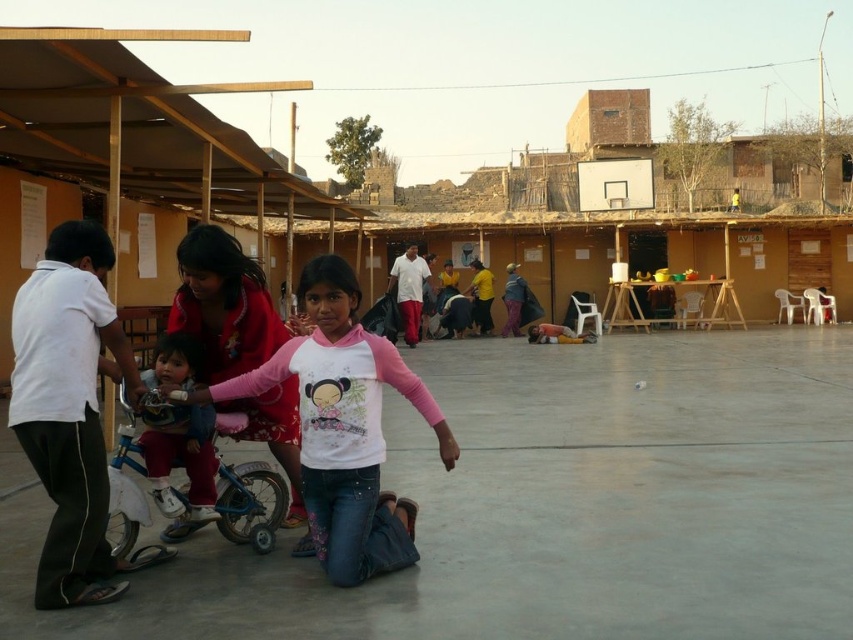
Question: Which object is the closest to the pink fabric shirt at center?

Choices:
 (A) blue plastic tricycle at center
 (B) light pink fabric shirt at center

Answer: (B)

Question: In this image, where is blue plastic tricycle at center located relative to light pink fabric shirt at center?

Choices:
 (A) left
 (B) right

Answer: (B)

Question: In this image, where is blue plastic tricycle at center located relative to light pink fabric shirt at center?

Choices:
 (A) right
 (B) left

Answer: (A)

Question: Can you confirm if pink fabric shirt at center is smaller than blue plastic tricycle at center?

Choices:
 (A) no
 (B) yes

Answer: (A)

Question: Which object is positioned farthest from the light pink fabric shirt at center?

Choices:
 (A) pink fabric shirt at center
 (B) blue plastic tricycle at center

Answer: (A)

Question: Which point is farther to the camera?

Choices:
 (A) (210, 413)
 (B) (183, 490)

Answer: (B)